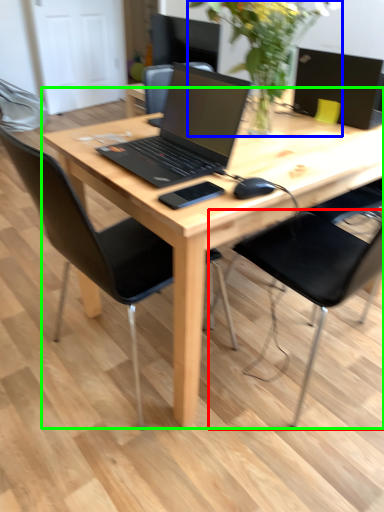
Question: Which object is the farthest from chair (highlighted by a red box)? Choose among these: floral arrangement (highlighted by a blue box) or desk (highlighted by a green box).

Choices:
 (A) floral arrangement
 (B) desk

Answer: (A)